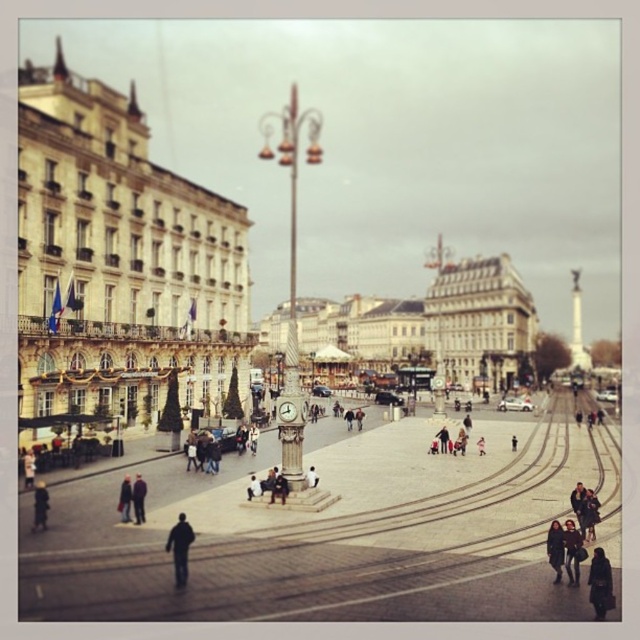
Question: Which point is farther to the camera?

Choices:
 (A) (595, 593)
 (B) (561, 547)

Answer: (B)

Question: Observing the image, what is the correct spatial positioning of dark gray jacket at lower center in reference to dark gray jacket at lower left?

Choices:
 (A) below
 (B) above

Answer: (A)

Question: Considering the relative positions of dark blue jacket at lower left and dark gray jacket at lower left in the image provided, where is dark blue jacket at lower left located with respect to dark gray jacket at lower left?

Choices:
 (A) left
 (B) right

Answer: (A)

Question: Where is dark gray jacket at lower center located in relation to dark gray jacket at lower left in the image?

Choices:
 (A) right
 (B) left

Answer: (A)

Question: Which point is farther to the camera?

Choices:
 (A) dark blue jeans at lower right
 (B) smooth concrete plaza at center
 (C) dark blue coat at center
 (D) dark blue jacket at lower left

Answer: (C)

Question: Which object is positioned farthest from the dark blue jacket at lower right?

Choices:
 (A) dark brown coat at lower right
 (B) dark blue jeans at lower right

Answer: (A)